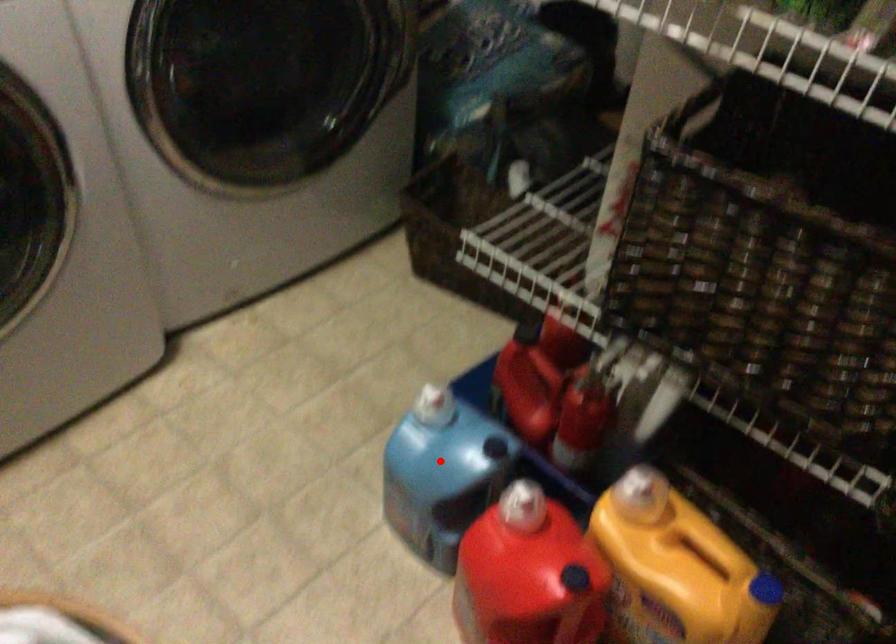
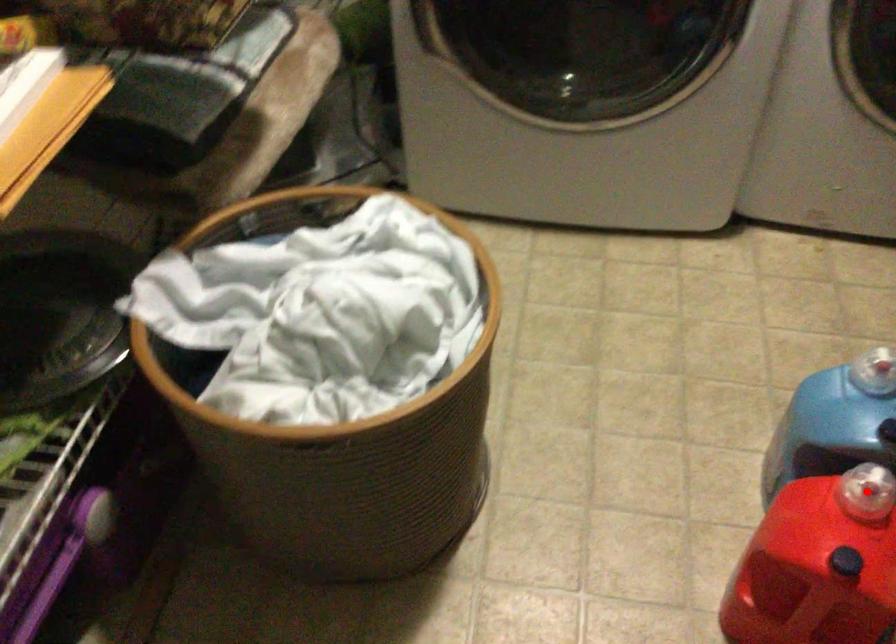
I am providing you with two images of the same scene from different viewpoints. A red point is marked on the first image and another point is marked on the second image. Is the marked point in image1 the same physical position as the marked point in image2?

No